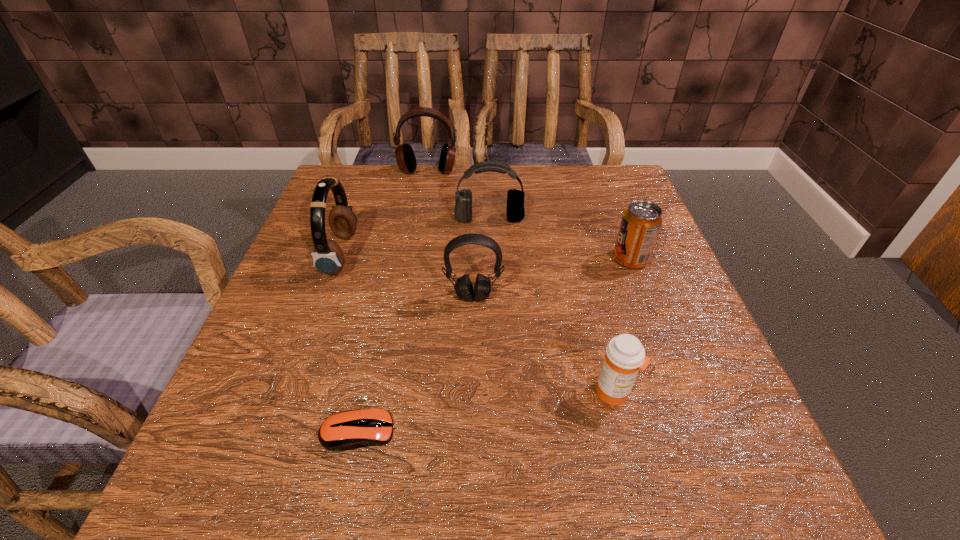
This screenshot has width=960, height=540. I want to click on free location that satisfies the following two spatial constraints: 1. on the ear cup of the shortest object; 2. on the left side of the second nearest headset, so click(277, 432).